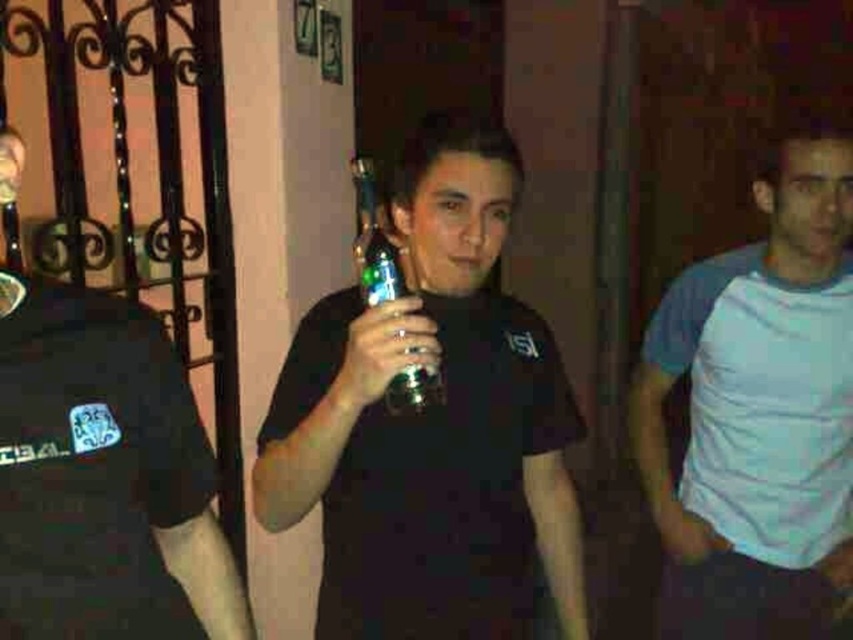
Question: Does matte black bottle at center lie in front of white cotton t-shirt at right?

Choices:
 (A) no
 (B) yes

Answer: (B)

Question: Among these points, which one is farthest from the camera?

Choices:
 (A) (395, 292)
 (B) (146, 589)

Answer: (A)

Question: Which point is farther to the camera?

Choices:
 (A) matte black bottle at center
 (B) black matte t-shirt at left

Answer: (A)

Question: Does white cotton t-shirt at right have a greater width compared to metallic green bottle at center?

Choices:
 (A) no
 (B) yes

Answer: (B)

Question: Which of the following is the closest to the observer?

Choices:
 (A) (323, 628)
 (B) (30, 323)
 (C) (755, 488)
 (D) (398, 404)

Answer: (B)

Question: Does black matte t-shirt at left have a larger size compared to metallic green bottle at center?

Choices:
 (A) yes
 (B) no

Answer: (A)